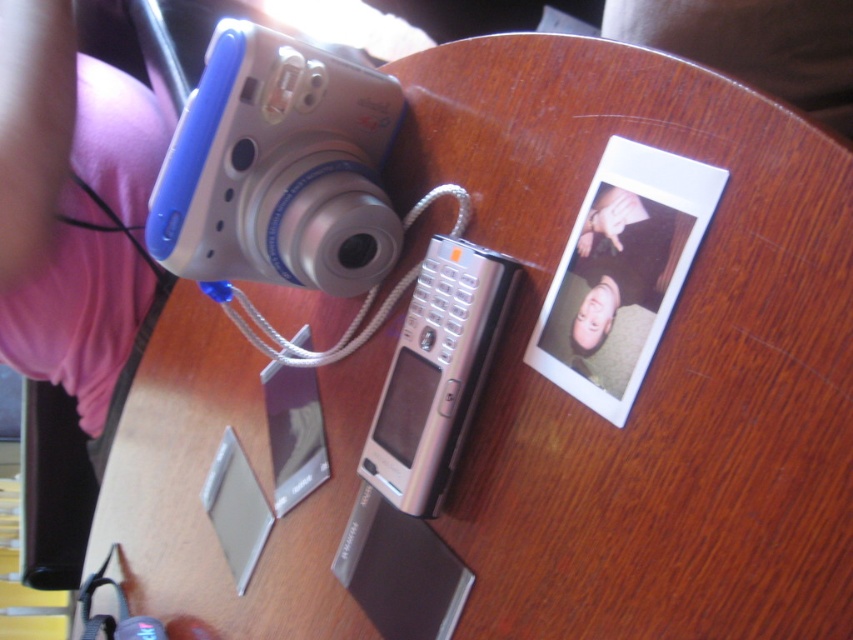
Question: Which point is farther to the camera?

Choices:
 (A) silver metallic phone at center
 (B) blue plastic camera at upper left

Answer: (B)

Question: Which object is closer to the camera taking this photo?

Choices:
 (A) blue plastic camera at upper left
 (B) matte silver phone at center
 (C) silver metallic phone at center

Answer: (B)

Question: Does blue plastic camera at upper left have a greater width compared to matte silver phone at center?

Choices:
 (A) yes
 (B) no

Answer: (A)

Question: Which is nearer to the silver metallic phone at center?

Choices:
 (A) matte silver phone at center
 (B) blue plastic camera at upper left

Answer: (A)

Question: Observing the image, what is the correct spatial positioning of blue plastic camera at upper left in reference to silver metallic phone at center?

Choices:
 (A) right
 (B) left

Answer: (B)

Question: Is blue plastic camera at upper left to the right of silver metallic phone at center from the viewer's perspective?

Choices:
 (A) no
 (B) yes

Answer: (A)